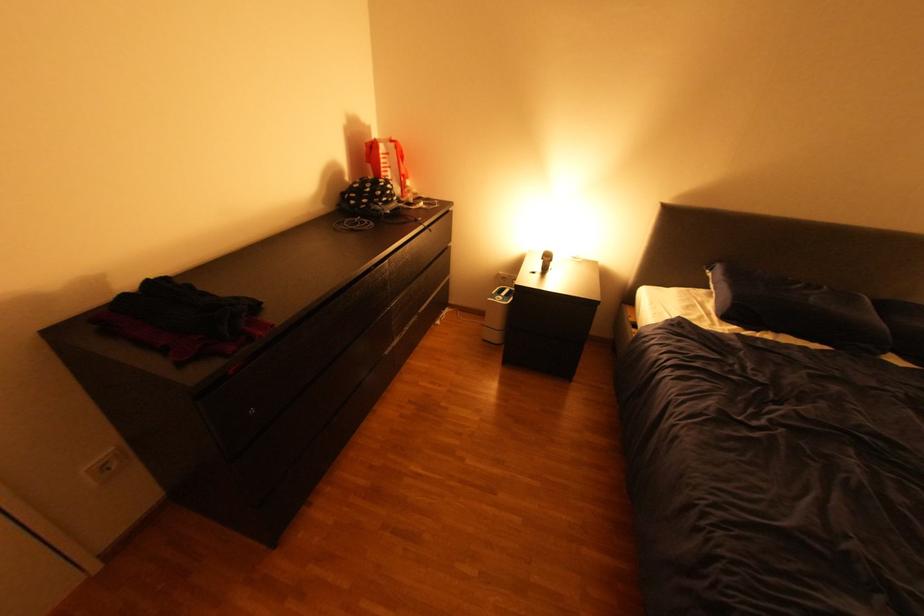
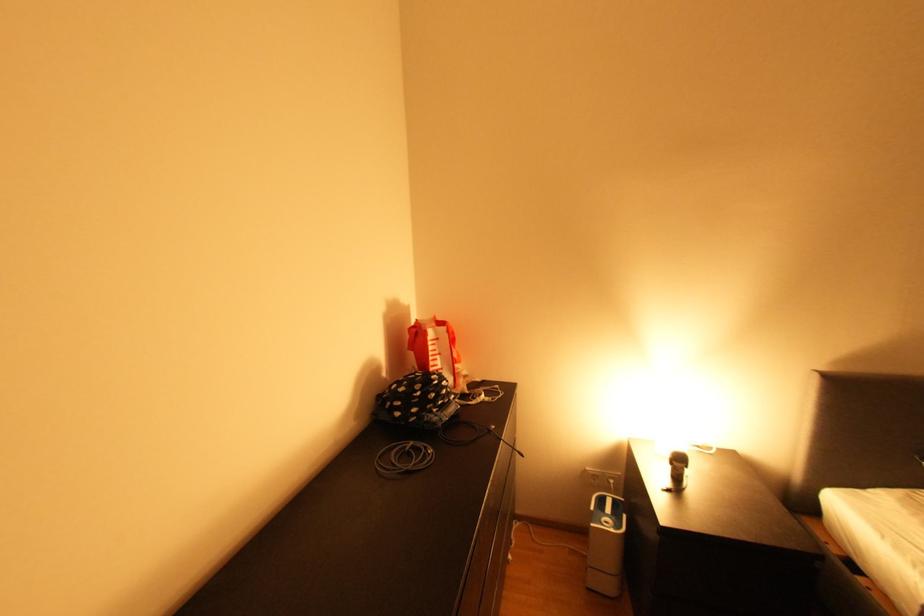
Question: How did the camera likely rotate?

Choices:
 (A) Left
 (B) Right
 (C) Up
 (D) Down

Answer: (C)